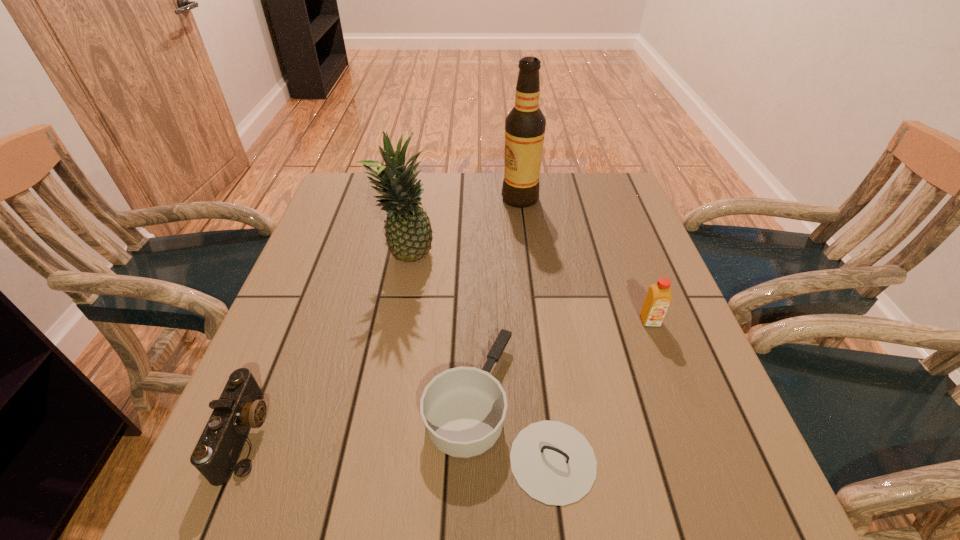
Identify the location of blank space that satisfies the following two spatial constraints: 1. on the front and back of the rightmost object; 2. on the front-facing side of the camera. (692, 435).

Identify the location of vacant space that satisfies the following two spatial constraints: 1. on the front side of the second tallest object; 2. on the left side of the shortest object. (377, 411).